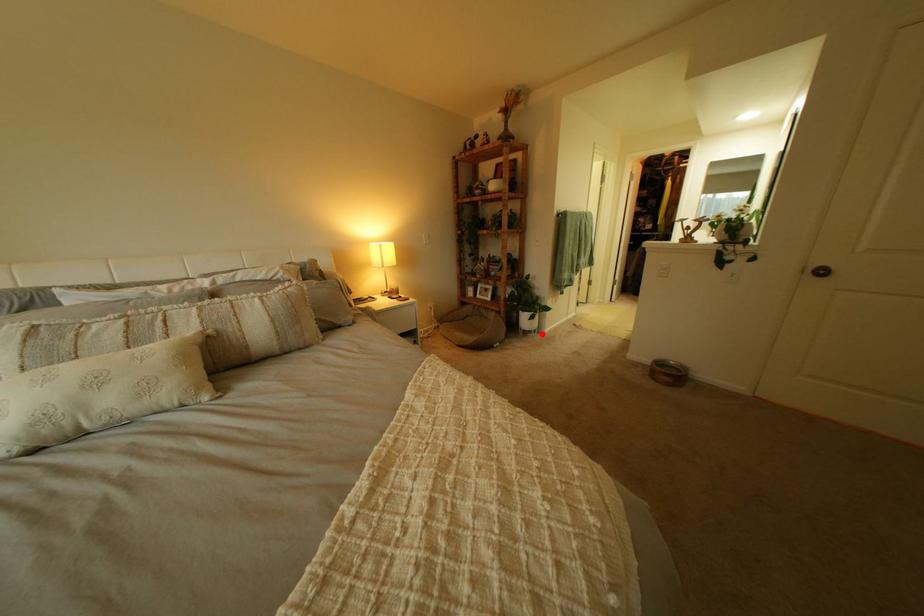
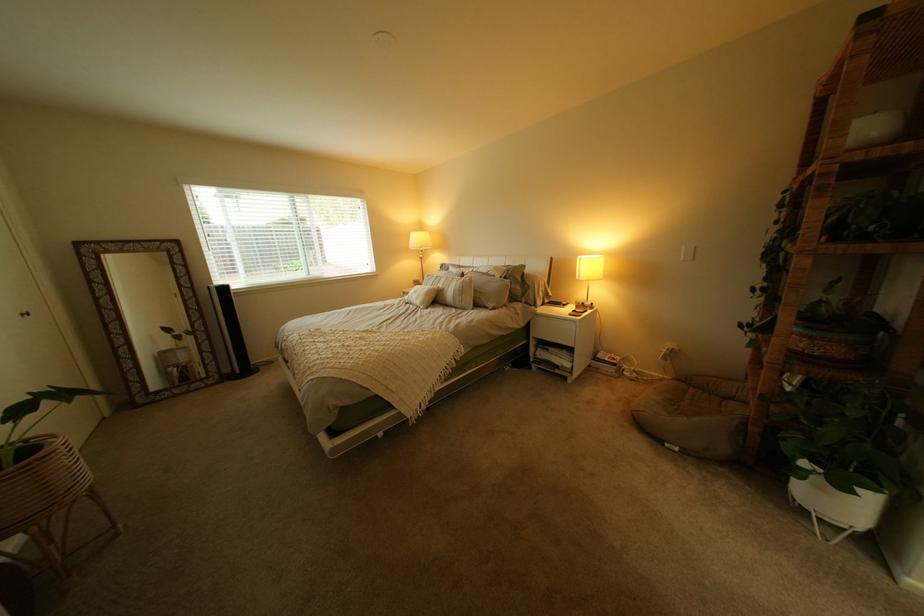
In the second image, find the point that corresponds to the highlighted location in the first image.

(821, 512)